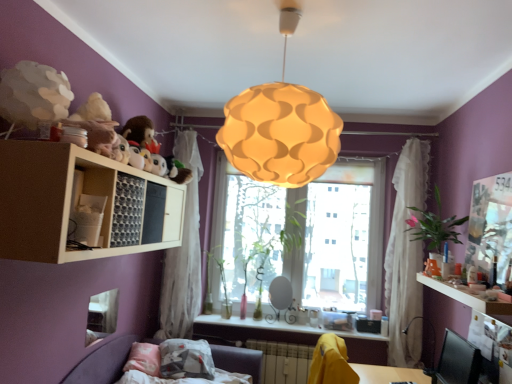
The height and width of the screenshot is (384, 512). I want to click on free location above green matte plant at window, positioned as the 2th plant in left-to-right order (from a real-world perspective), so click(246, 226).